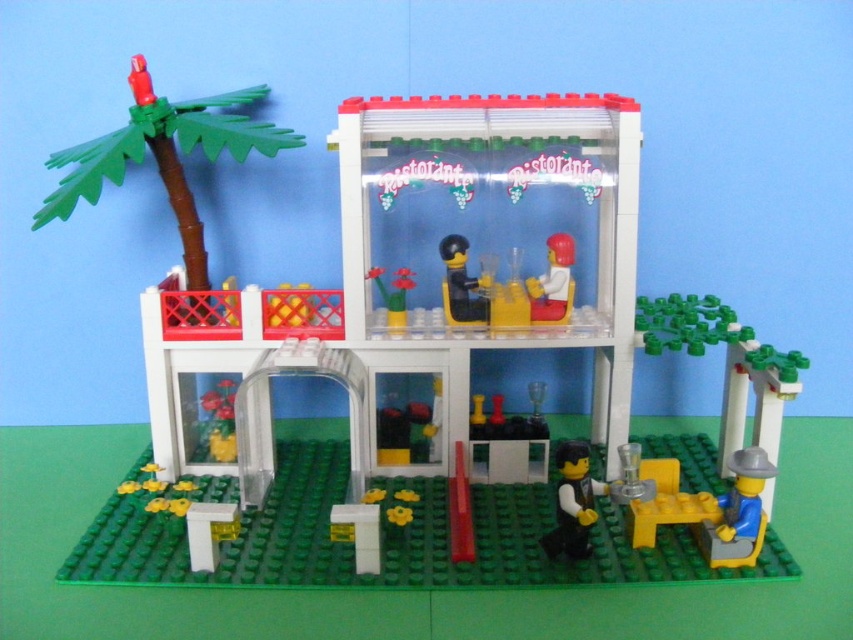
Question: Does smooth black cup at center have a greater width compared to green plastic flower pot at center?

Choices:
 (A) no
 (B) yes

Answer: (B)

Question: Which object is the farthest from the smooth black cup at center?

Choices:
 (A) white plastic cup at upper center
 (B) green plastic flower pot at center
 (C) black plastic figure at lower right
 (D) green matte palm tree at left

Answer: (D)

Question: Can you confirm if smooth black cup at center is wider than green plastic flower pot at center?

Choices:
 (A) yes
 (B) no

Answer: (A)

Question: Can you confirm if green matte palm tree at left is positioned above white plastic cup at upper center?

Choices:
 (A) yes
 (B) no

Answer: (A)

Question: Among these points, which one is farthest from the camera?

Choices:
 (A) (566, 275)
 (B) (558, 529)

Answer: (A)

Question: Which of the following is the closest to the observer?

Choices:
 (A) click(x=392, y=300)
 (B) click(x=567, y=253)

Answer: (B)